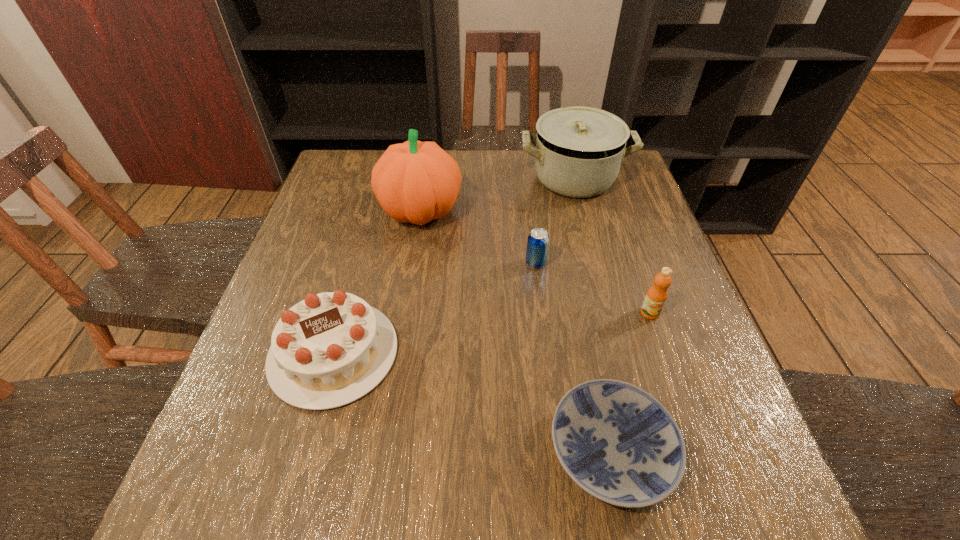
Where is `free space located on the right of the birthday cake`? The height and width of the screenshot is (540, 960). free space located on the right of the birthday cake is located at coordinates (468, 353).

Where is `vacant space situated 0.390m on the front of the fifth tallest object`? vacant space situated 0.390m on the front of the fifth tallest object is located at coordinates (556, 428).

The image size is (960, 540). I want to click on blank space located on the back of the shortest object, so click(573, 266).

I want to click on pumpkin located at the far edge, so click(416, 182).

Find the location of `saucepan at the far edge`. saucepan at the far edge is located at coordinates (578, 151).

Find the location of a particular element. The width and height of the screenshot is (960, 540). object present at the near edge is located at coordinates (618, 443).

At what (x,y) coordinates should I click in order to perform the action: click on object that is at the left edge. Please return your answer as a coordinate pair (x, y). This screenshot has height=540, width=960. Looking at the image, I should click on (332, 348).

Find the location of a particular element. Image resolution: width=960 pixels, height=540 pixels. saucepan that is at the right edge is located at coordinates (578, 151).

Locate an element on the screen. orange juice present at the right edge is located at coordinates (656, 296).

Identify the location of plate that is at the right edge. (618, 443).